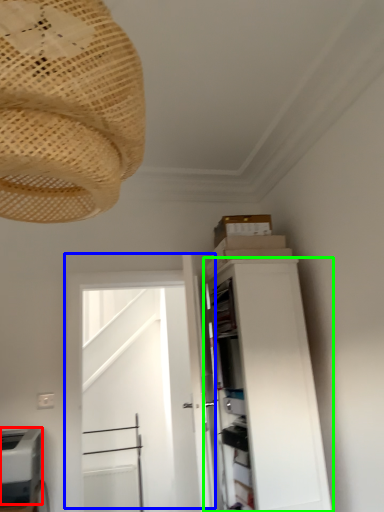
Question: Estimate the real-world distances between objects in this image. Which object is closer to appliance (highlighted by a red box), door (highlighted by a blue box) or cabinetry (highlighted by a green box)?

Choices:
 (A) door
 (B) cabinetry

Answer: (B)